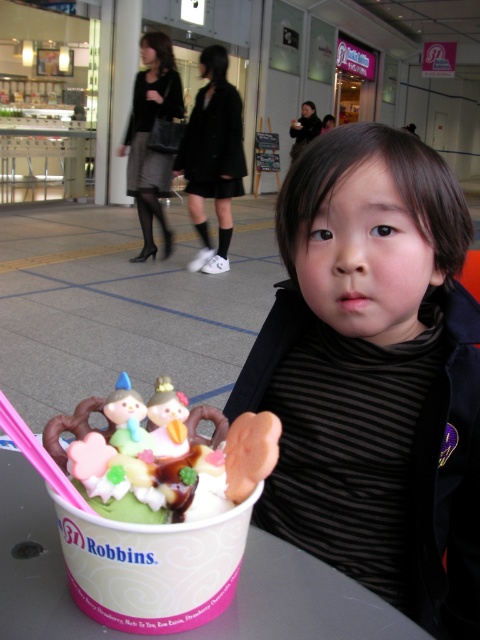
Looking at this image, can you confirm if black fabric skirt at center is positioned to the right of matte black skirt at center?

Indeed, black fabric skirt at center is positioned on the right side of matte black skirt at center.

Can you confirm if black fabric skirt at center is thinner than matte black skirt at center?

Correct, black fabric skirt at center's width is less than matte black skirt at center's.

Where is `black fabric skirt at center`? black fabric skirt at center is located at coordinates pyautogui.click(x=213, y=157).

Between black striped shirt at center and matte black skirt at center, which one appears on the right side from the viewer's perspective?

black striped shirt at center

This screenshot has height=640, width=480. In order to click on black striped shirt at center in this screenshot , I will do `click(374, 380)`.

Locate an element on the screen. black striped shirt at center is located at coordinates (374, 380).

Does black striped shirt at center have a smaller size compared to black fabric skirt at center?

Indeed, black striped shirt at center has a smaller size compared to black fabric skirt at center.

Is the position of black striped shirt at center less distant than that of black fabric skirt at center?

Yes, it is.

The width and height of the screenshot is (480, 640). Find the location of `black striped shirt at center`. black striped shirt at center is located at coordinates (374, 380).

Find the location of a particular element. The width and height of the screenshot is (480, 640). black striped shirt at center is located at coordinates (374, 380).